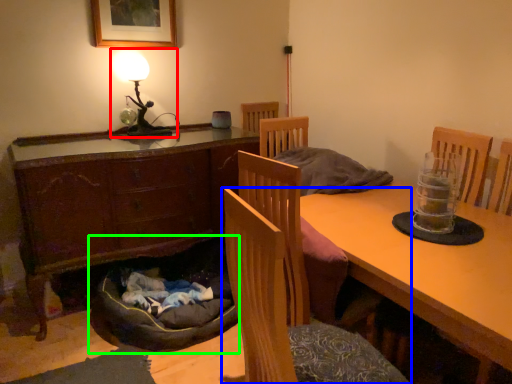
Question: Estimate the real-world distances between objects in this image. Which object is farther from table lamp (highlighted by a red box), chair (highlighted by a blue box) or dog bed (highlighted by a green box)?

Choices:
 (A) chair
 (B) dog bed

Answer: (A)